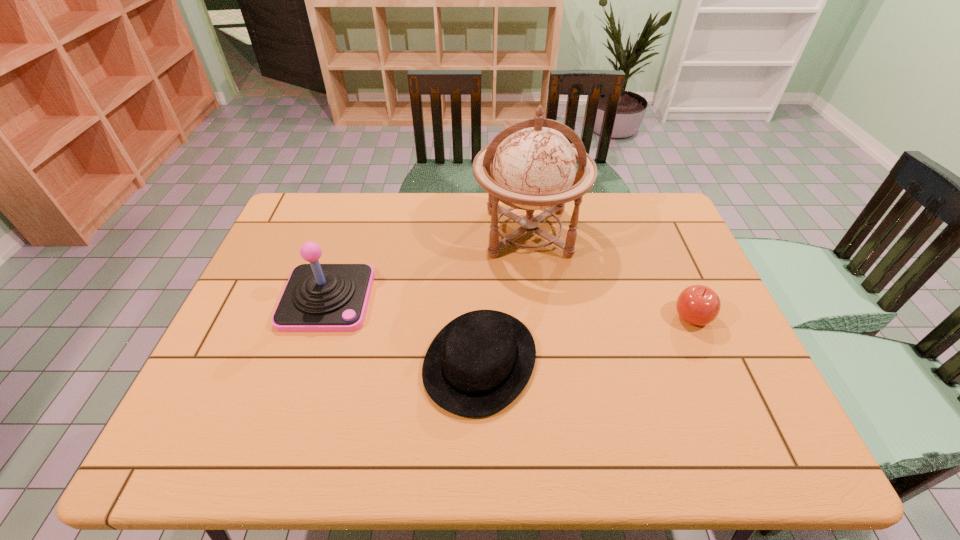
In order to click on vacant area that lies between the shortest object and the tallest object in this screenshot , I will do `click(504, 297)`.

The width and height of the screenshot is (960, 540). I want to click on vacant point located between the third shortest object and the globe, so click(427, 266).

Where is `empty space that is in between the third tallest object and the tallest object`? Image resolution: width=960 pixels, height=540 pixels. empty space that is in between the third tallest object and the tallest object is located at coordinates (610, 275).

At what (x,y) coordinates should I click in order to perform the action: click on free space that is in between the globe and the fedora. Please return your answer as a coordinate pair (x, y). Looking at the image, I should click on tap(504, 297).

Find the location of `unoccupied area between the shortest object and the second shortest object`. unoccupied area between the shortest object and the second shortest object is located at coordinates (586, 339).

The image size is (960, 540). I want to click on empty space between the leftmost object and the tallest object, so click(427, 266).

You are a GUI agent. You are given a task and a screenshot of the screen. Output one action in this format:
    pyautogui.click(x=<x>, y=<y>)
    Task: Click on the free area in between the tallest object and the second shortest object
    This screenshot has width=960, height=540.
    Given the screenshot: What is the action you would take?
    pyautogui.click(x=610, y=275)

This screenshot has width=960, height=540. I want to click on vacant space that is in between the shortest object and the globe, so click(504, 297).

This screenshot has width=960, height=540. Find the location of `vacant region between the second tallest object and the rightmost object`. vacant region between the second tallest object and the rightmost object is located at coordinates (510, 308).

Find the location of `free area in between the shortest object and the tallest object`. free area in between the shortest object and the tallest object is located at coordinates (504, 297).